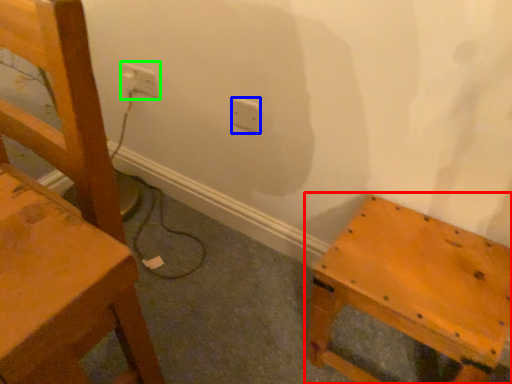
Question: Considering the real-world distances, which object is closest to furniture (highlighted by a red box)? electric outlet (highlighted by a blue box) or electric outlet (highlighted by a green box).

Choices:
 (A) electric outlet
 (B) electric outlet

Answer: (A)